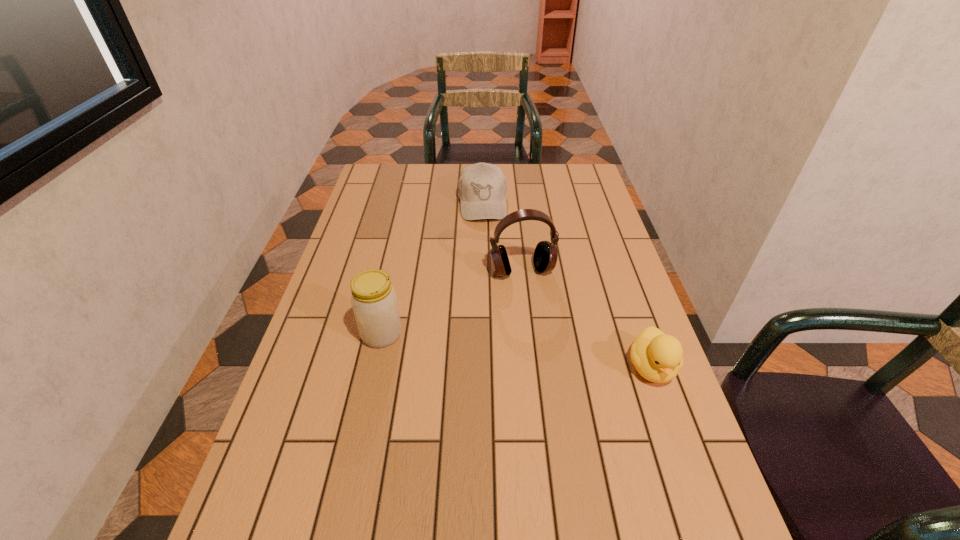
I want to click on jar, so click(374, 301).

Identify the location of duck. The height and width of the screenshot is (540, 960). (657, 357).

This screenshot has width=960, height=540. Identify the location of the second farthest object. (545, 255).

You are a GUI agent. You are given a task and a screenshot of the screen. Output one action in this format:
    pyautogui.click(x=<x>, y=<y>)
    Task: Click on the farthest object
    This screenshot has width=960, height=540.
    Given the screenshot: What is the action you would take?
    pyautogui.click(x=482, y=188)

Where is `free space located 0.170m on the back of the jar`? The height and width of the screenshot is (540, 960). free space located 0.170m on the back of the jar is located at coordinates (394, 277).

Where is `free space located 0.060m on the front-facing side of the rightmost object`? free space located 0.060m on the front-facing side of the rightmost object is located at coordinates (669, 417).

The width and height of the screenshot is (960, 540). Identify the location of free point located on the ear pads of the headset. (536, 305).

You are a GUI agent. You are given a task and a screenshot of the screen. Output one action in this format:
    pyautogui.click(x=<x>, y=<y>)
    Task: Click on the free space located 0.340m on the ear pads of the headset
    The width and height of the screenshot is (960, 540).
    Given the screenshot: What is the action you would take?
    pyautogui.click(x=560, y=379)

Identify the location of vacant position located 0.090m on the ear pads of the headset. (536, 305).

At what (x,y) coordinates should I click in order to perform the action: click on vacant space located on the front-facing side of the baseball cap. Please return your answer as a coordinate pair (x, y). Image resolution: width=960 pixels, height=540 pixels. Looking at the image, I should click on (488, 274).